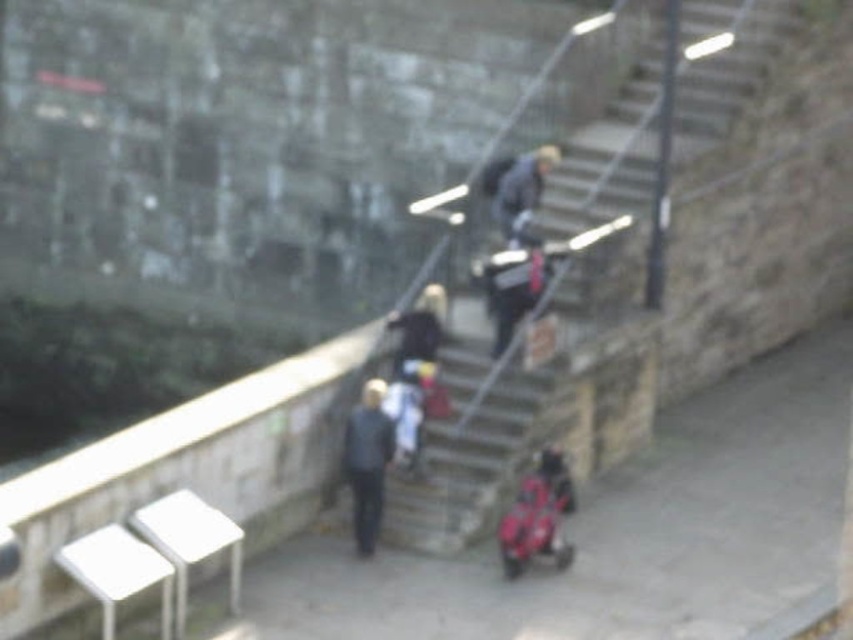
Question: Is dark blue jacket at upper center further to the viewer compared to dark gray jacket at upper center?

Choices:
 (A) yes
 (B) no

Answer: (B)

Question: Among these points, which one is nearest to the camera?

Choices:
 (A) (381, 387)
 (B) (413, 528)

Answer: (A)

Question: Which of the following is the farthest from the observer?

Choices:
 (A) (515, 195)
 (B) (416, 321)
 (C) (654, 45)
 (D) (526, 308)

Answer: (C)

Question: Is dark blue jacket at center below dark gray jacket at upper center?

Choices:
 (A) no
 (B) yes

Answer: (B)

Question: Which of these objects is positioned farthest from the dark gray sweater at center?

Choices:
 (A) stone stairs at center
 (B) dark blue jacket at center
 (C) dark blue jacket at upper center

Answer: (A)

Question: From the image, what is the correct spatial relationship of dark gray jacket at upper center in relation to dark gray sweater at center?

Choices:
 (A) above
 (B) below

Answer: (A)